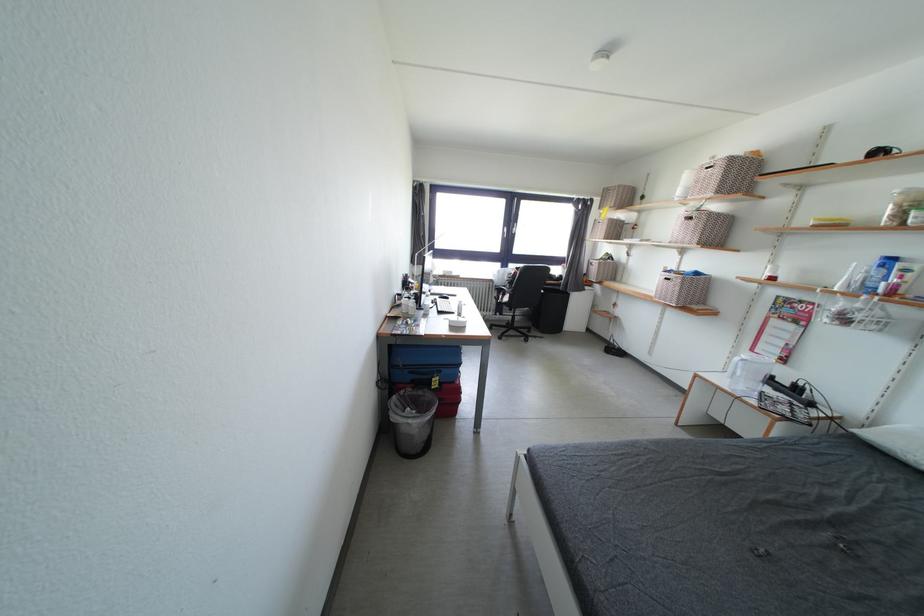
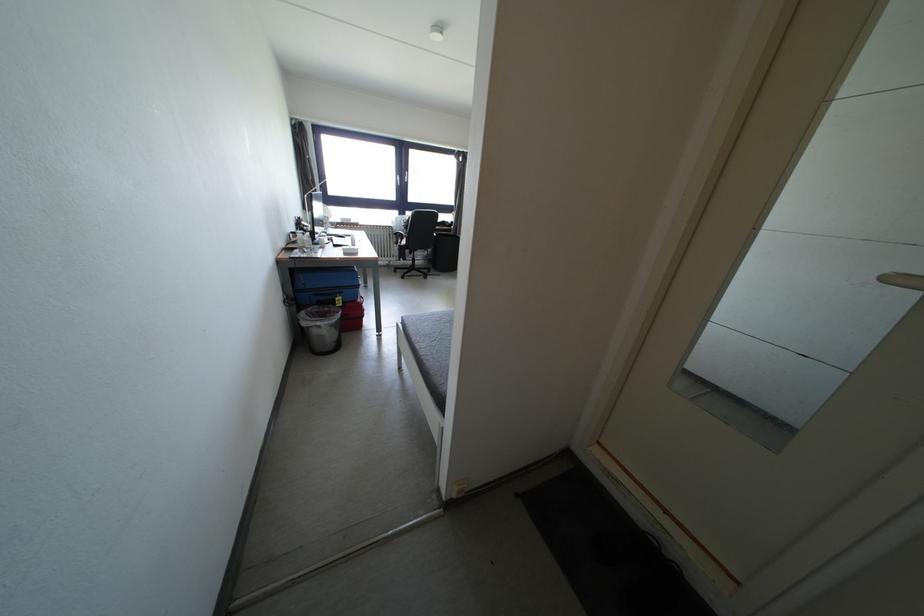
The point at (x=440, y=384) is marked in the first image. Where is the corresponding point in the second image?

(344, 302)